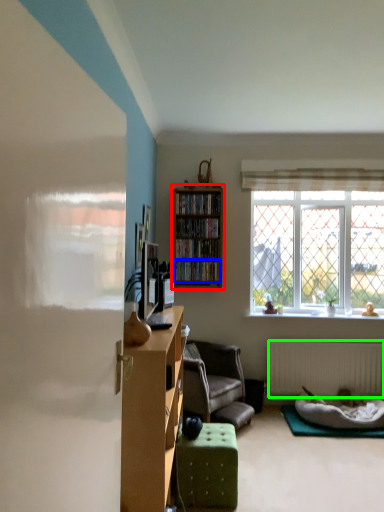
Question: Which is farther away from shelf (highlighted by a red box)? book (highlighted by a blue box) or radiator (highlighted by a green box)?

Choices:
 (A) book
 (B) radiator

Answer: (B)